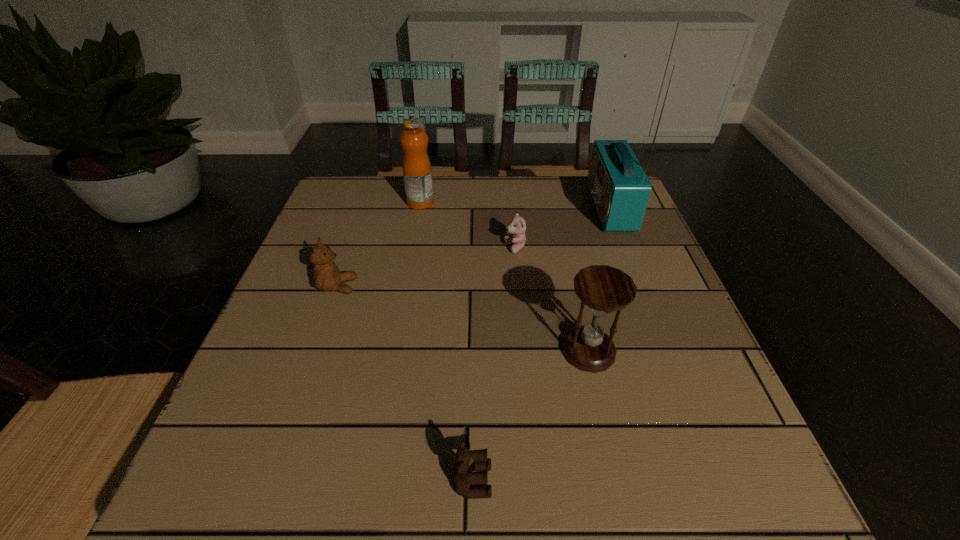
Image resolution: width=960 pixels, height=540 pixels. Identify the location of blank area located at the face of the fourth object from left to right. (414, 248).

Locate an element on the screen. The height and width of the screenshot is (540, 960). vacant region located 0.110m on the face of the second teddy bear from right to left is located at coordinates (569, 481).

What are the coordinates of `radio receiver at the far edge` in the screenshot? It's located at pyautogui.click(x=620, y=189).

Find the location of a particular element. Image resolution: width=960 pixels, height=540 pixels. fruit juice positioned at the far edge is located at coordinates (416, 165).

The height and width of the screenshot is (540, 960). What are the coordinates of `object that is at the near edge` in the screenshot? It's located at (468, 462).

Image resolution: width=960 pixels, height=540 pixels. In order to click on object situated at the left edge in this screenshot , I will do `click(327, 277)`.

Identify the location of radio receiver that is at the right edge. This screenshot has width=960, height=540. (620, 189).

The image size is (960, 540). I want to click on hourglass that is at the right edge, so click(x=604, y=289).

Find the location of a particular element. The width and height of the screenshot is (960, 540). object that is positioned at the far right corner is located at coordinates (620, 189).

In the image, there is a desktop. Where is `free space at the far edge`? free space at the far edge is located at coordinates (537, 224).